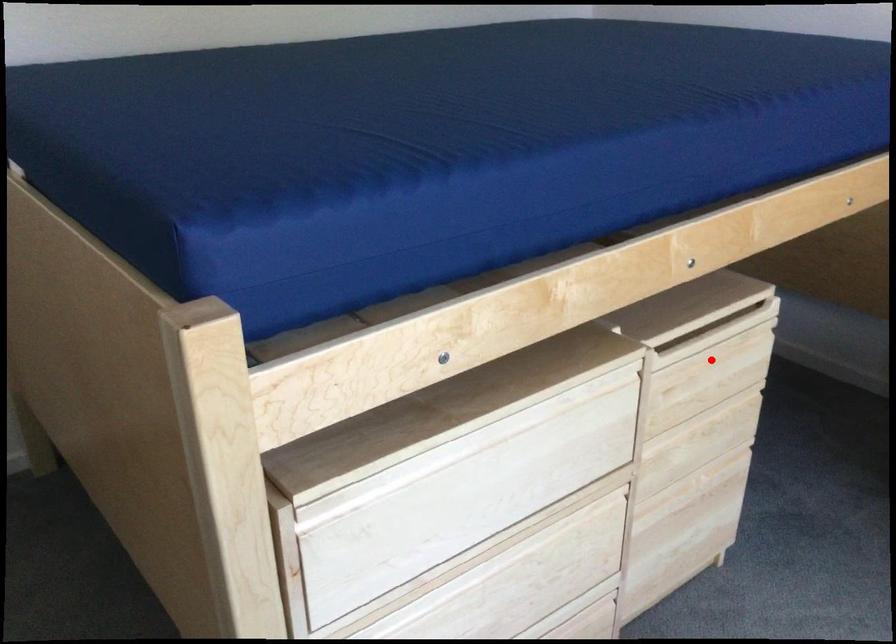
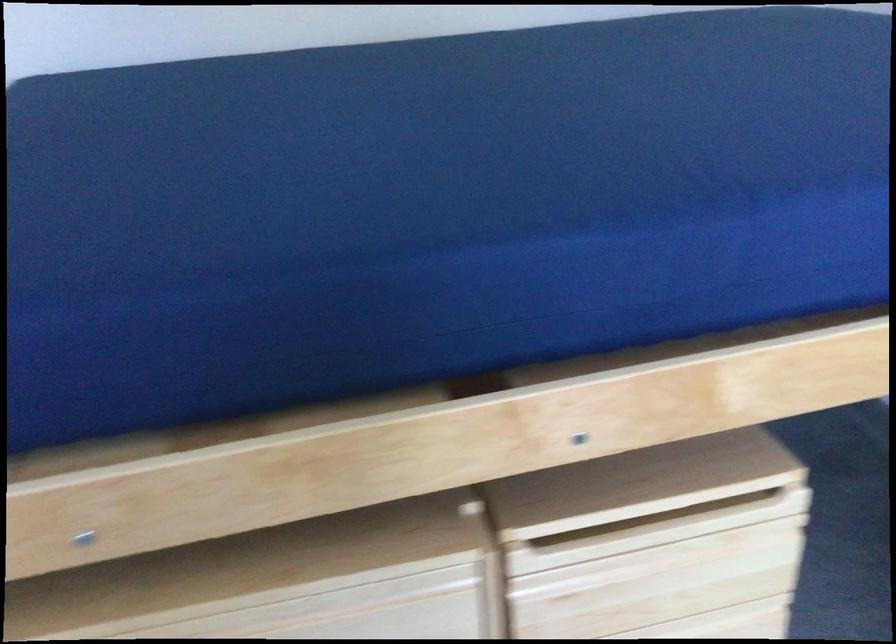
Question: I am providing you with two images of the same scene from different viewpoints. Image1 has a red point marked. In image2, the corresponding 3D location appears at what relative position? Reply with the corresponding letter.

Choices:
 (A) Closer
 (B) Farther

Answer: (A)